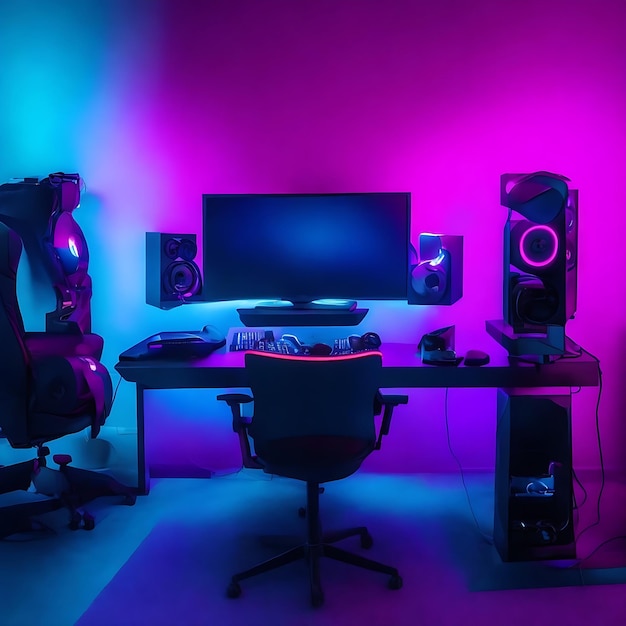
You are a GUI agent. You are given a task and a screenshot of the screen. Output one action in this format:
    pyautogui.click(x=<x>, y=<y>)
    Task: Click on the computer tower/case
    The height and width of the screenshot is (626, 626).
    Given the screenshot: What is the action you would take?
    pyautogui.click(x=531, y=444)